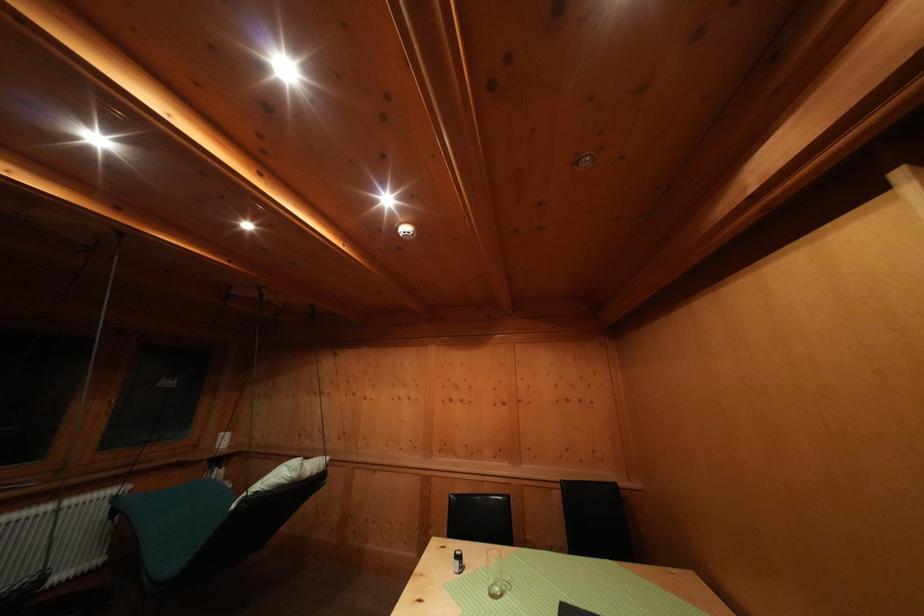
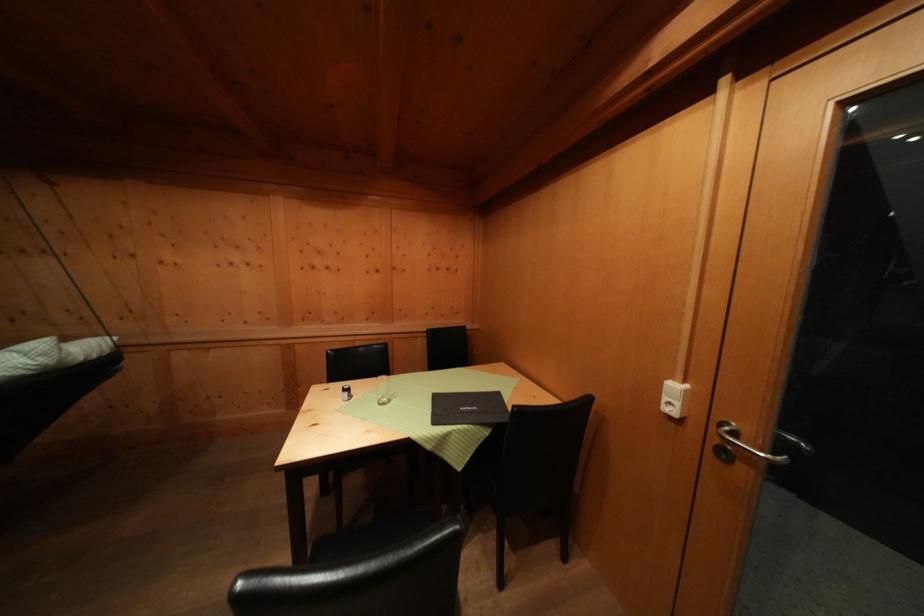
Where in the second image is the point corresponding to the point at 502,589 from the first image?

(388, 403)